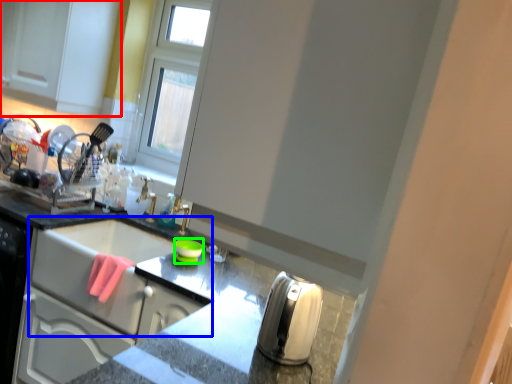
Question: Which object is the closest to the cabinetry (highlighted by a red box)? Choose among these: sink (highlighted by a blue box) or appliance (highlighted by a green box).

Choices:
 (A) sink
 (B) appliance

Answer: (A)